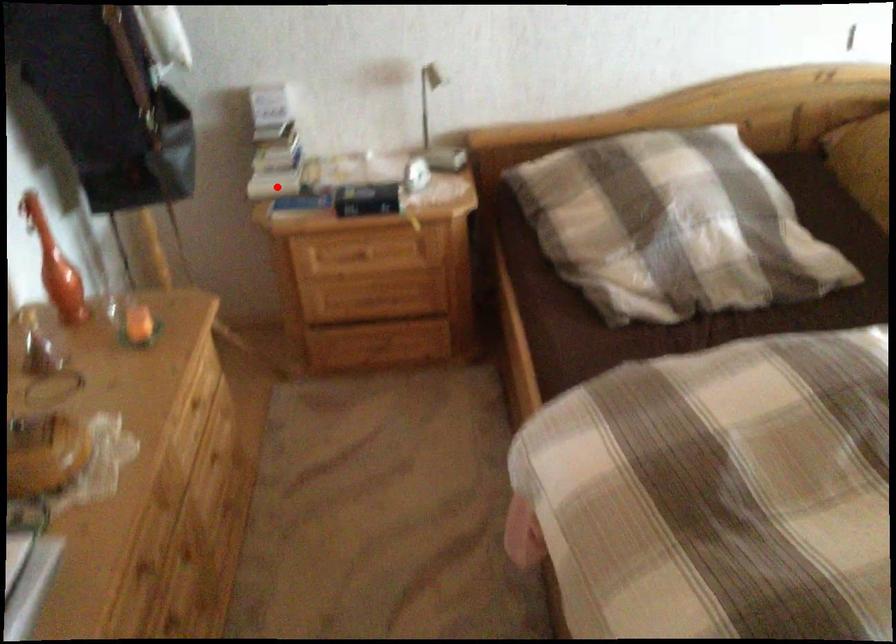
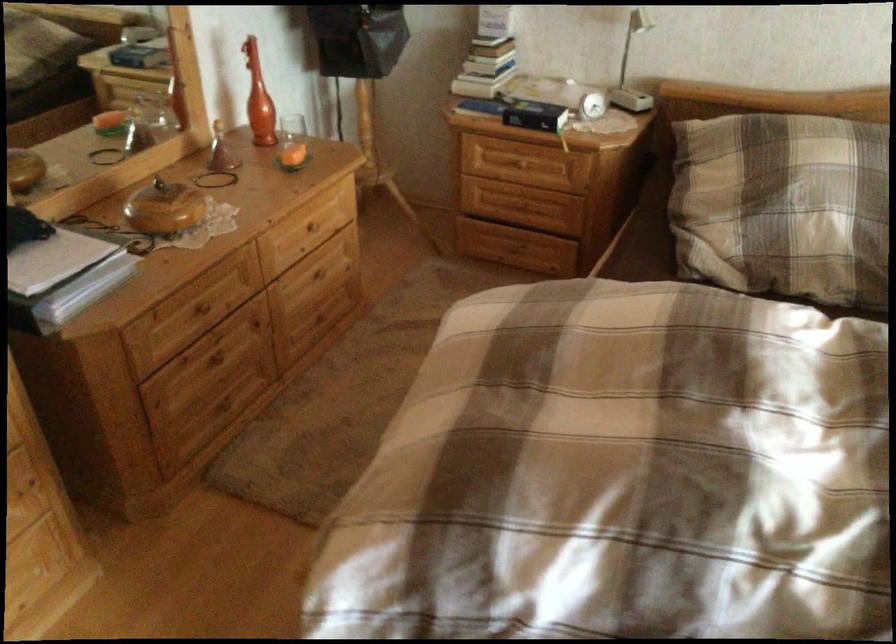
The point at the highlighted location is marked in the first image. Where is the corresponding point in the second image?

(474, 86)